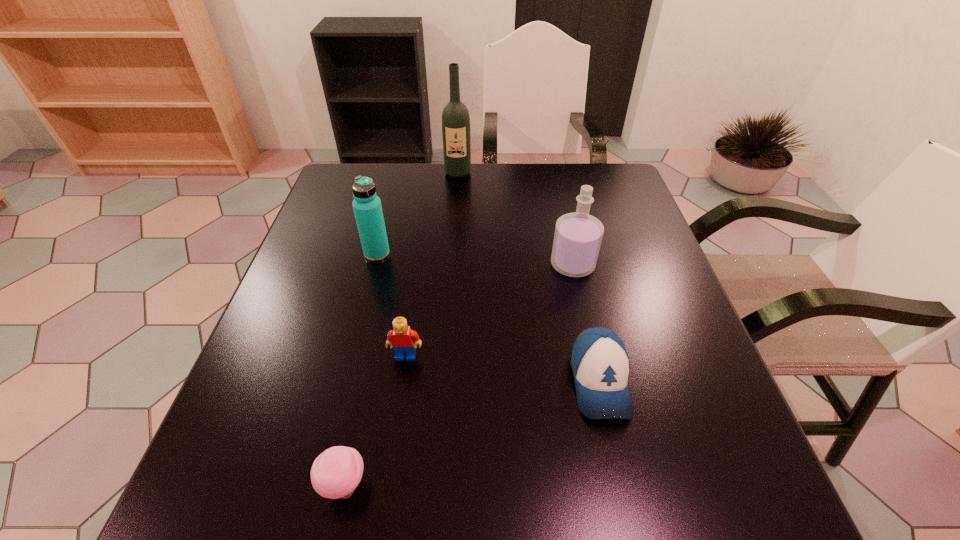
The width and height of the screenshot is (960, 540). What are the coordinates of `wine bottle` in the screenshot? It's located at (455, 117).

What are the coordinates of `the third object from right to left` in the screenshot? It's located at (455, 117).

The height and width of the screenshot is (540, 960). Identify the location of perfume. (577, 239).

Where is `water bottle`? water bottle is located at coordinates click(x=367, y=208).

This screenshot has width=960, height=540. What are the coordinates of `the third shortest object` in the screenshot? It's located at (401, 338).

Locate an element on the screen. baseball cap is located at coordinates (600, 363).

Locate an element on the screen. This screenshot has height=540, width=960. the nearest object is located at coordinates (335, 473).

I want to click on vacant space situated on the labeled side of the fourth object from left to right, so click(455, 211).

Where is `vacant area located on the front of the perfume`? The width and height of the screenshot is (960, 540). vacant area located on the front of the perfume is located at coordinates (582, 306).

You are a GUI agent. You are given a task and a screenshot of the screen. Output one action in this format:
    pyautogui.click(x=<x>, y=<y>)
    Task: Click on the free space located 0.370m on the front of the water bottle
    The image size is (960, 540).
    Given the screenshot: What is the action you would take?
    tap(340, 397)